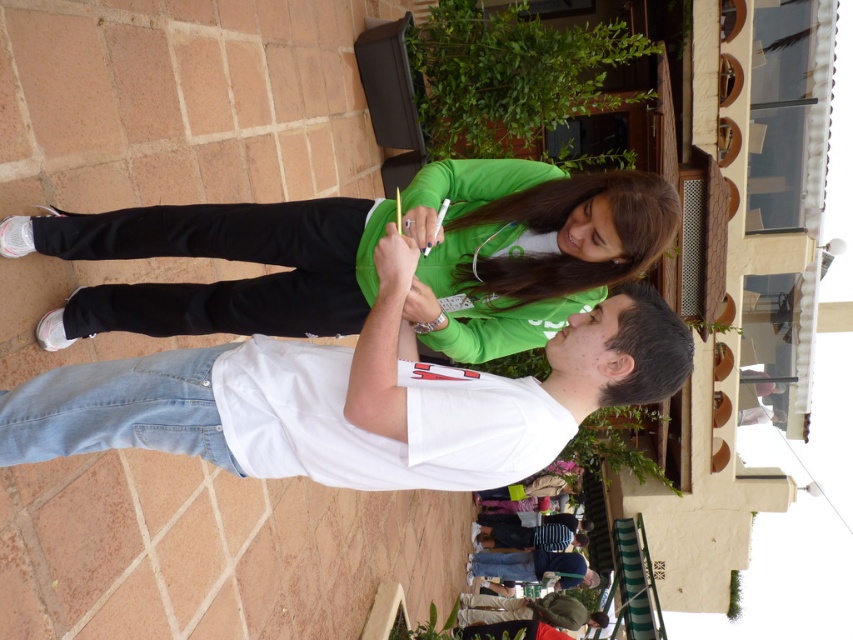
You are a fashion designer observing the two people in the image. You need to determine which item of clothing is narrower between the white denim jeans at center and the green matte shirt at center. Which one is narrower?

The white denim jeans at center is thinner than the green matte shirt at center, so the white denim jeans at center is narrower.

You are standing at the origin of the coordinate system in the image. You want to walk to the point at coordinates [354,397]. Which object should you head towards?

The point at coordinates [354,397] is located on the white denim jeans at center, so you should head towards the white denim jeans at center.

You are a photographer trying to capture a photo of the white denim jeans at center and the green matte shirt at center. Since you want to focus on both objects, which one should you adjust your camera angle to look up at or down at?

You should adjust your camera angle to look down at the white denim jeans at center because it is located below the green matte shirt at center.